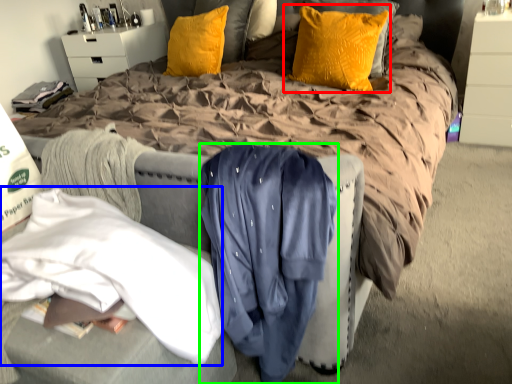
Question: Which is farther away from pillow (highlighted by a red box)? clothing (highlighted by a blue box) or clothing (highlighted by a green box)?

Choices:
 (A) clothing
 (B) clothing

Answer: (A)